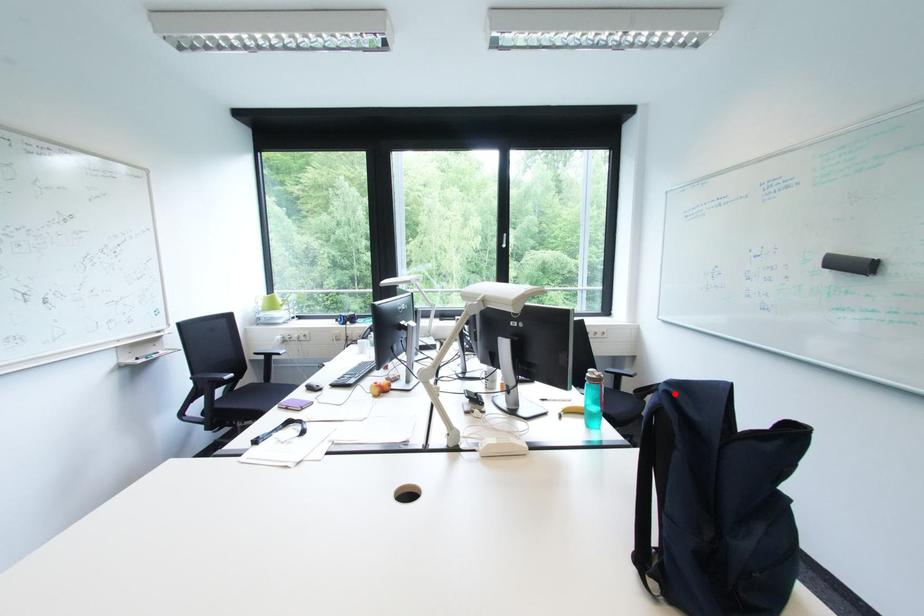
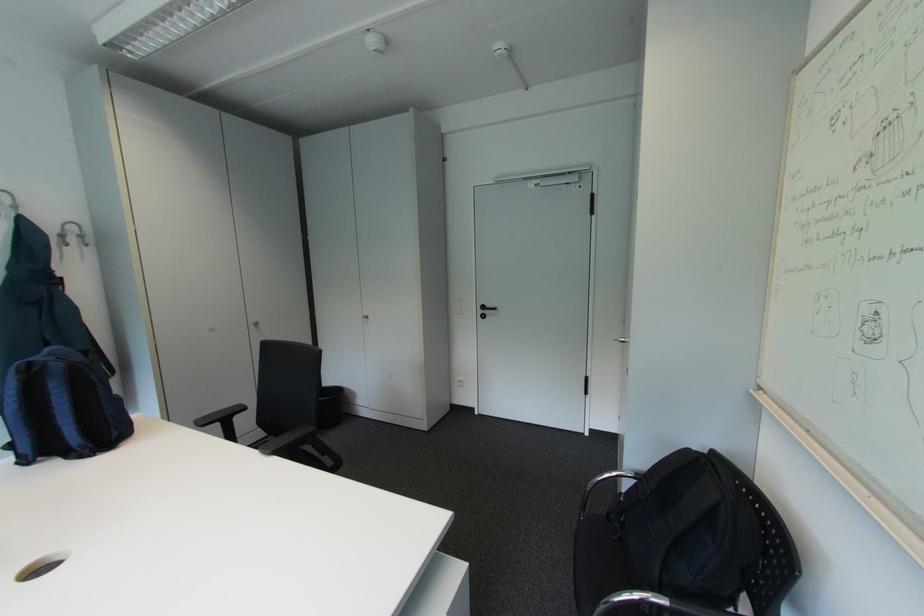
In the second image, find the point that corresponds to the highlighted location in the first image.

(67, 360)